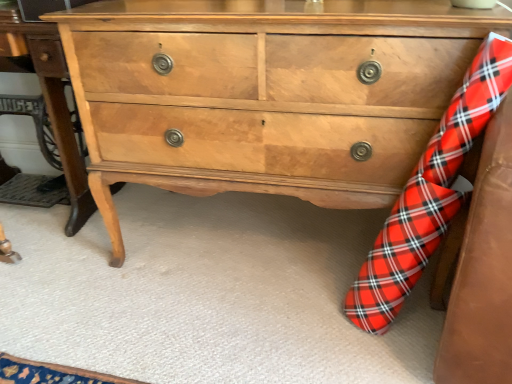
Question: Based on their sizes in the image, would you say light brown wood table at center is bigger or smaller than red plaid sock at lower right?

Choices:
 (A) small
 (B) big

Answer: (B)

Question: From a real-world perspective, is light brown wood table at center positioned above or below red plaid sock at lower right?

Choices:
 (A) below
 (B) above

Answer: (B)

Question: Estimate the real-world distances between objects in this image. Which object is closer to the red plaid sock at lower right?

Choices:
 (A) light brown wood table at center
 (B) light brown wood chest of drawers at center

Answer: (B)

Question: Estimate the real-world distances between objects in this image. Which object is farther from the light brown wood chest of drawers at center?

Choices:
 (A) light brown wood table at center
 (B) red plaid sock at lower right

Answer: (A)